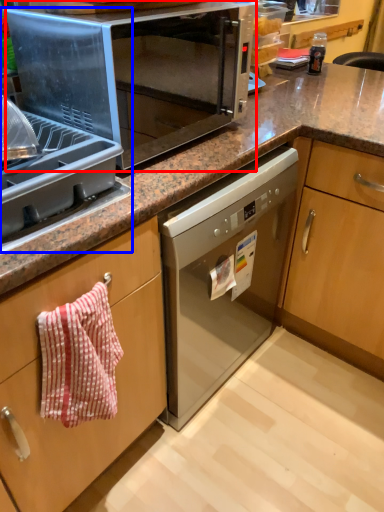
Question: Which object is further to the camera taking this photo, microwave oven (highlighted by a red box) or appliance (highlighted by a blue box)?

Choices:
 (A) microwave oven
 (B) appliance

Answer: (A)